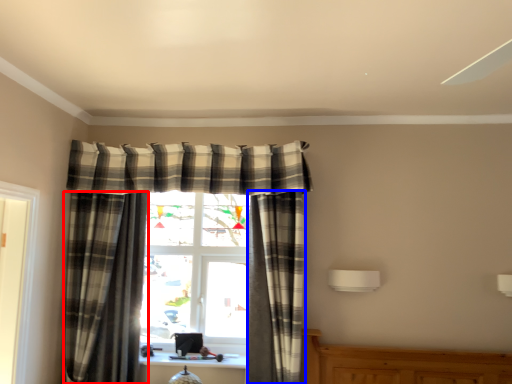
Question: Among these objects, which one is nearest to the camera, curtain (highlighted by a red box) or curtain (highlighted by a blue box)?

Choices:
 (A) curtain
 (B) curtain

Answer: (A)